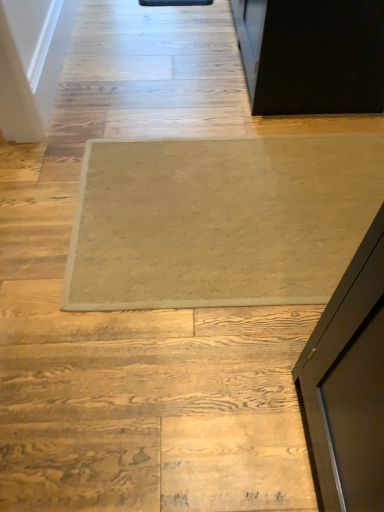
Question: Is beige carpet at center in front of or behind beige carpet at center in the image?

Choices:
 (A) front
 (B) behind

Answer: (A)

Question: Is beige carpet at center bigger or smaller than beige carpet at center?

Choices:
 (A) small
 (B) big

Answer: (B)

Question: From the image's perspective, is beige carpet at center positioned above or below beige carpet at center?

Choices:
 (A) below
 (B) above

Answer: (B)

Question: In the image, is beige carpet at center on the left side or the right side of beige carpet at center?

Choices:
 (A) right
 (B) left

Answer: (A)

Question: Relative to beige carpet at center, is beige carpet at center in front or behind?

Choices:
 (A) behind
 (B) front

Answer: (A)

Question: From the image's perspective, relative to beige carpet at center, is beige carpet at center above or below?

Choices:
 (A) below
 (B) above

Answer: (A)

Question: Is beige carpet at center spatially inside beige carpet at center, or outside of it?

Choices:
 (A) inside
 (B) outside

Answer: (A)